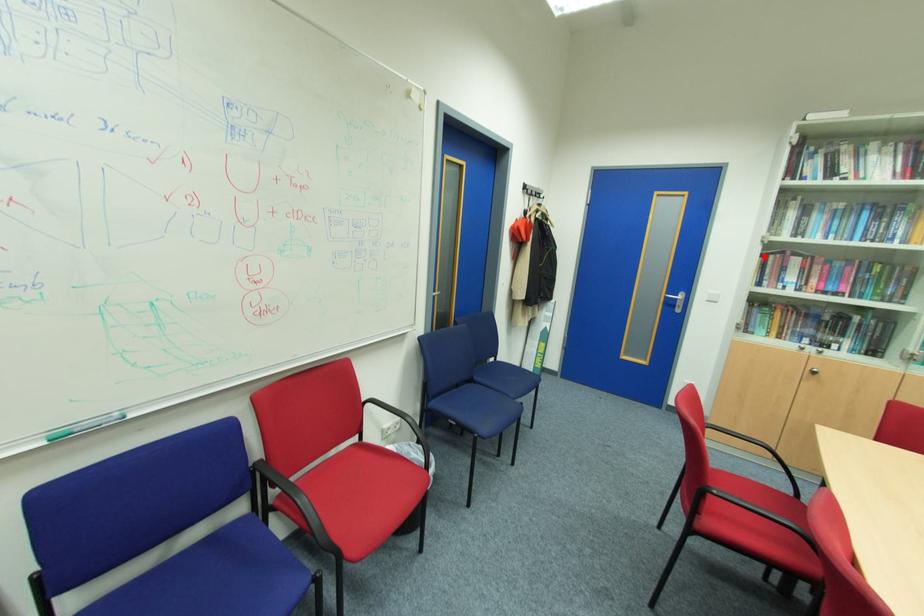
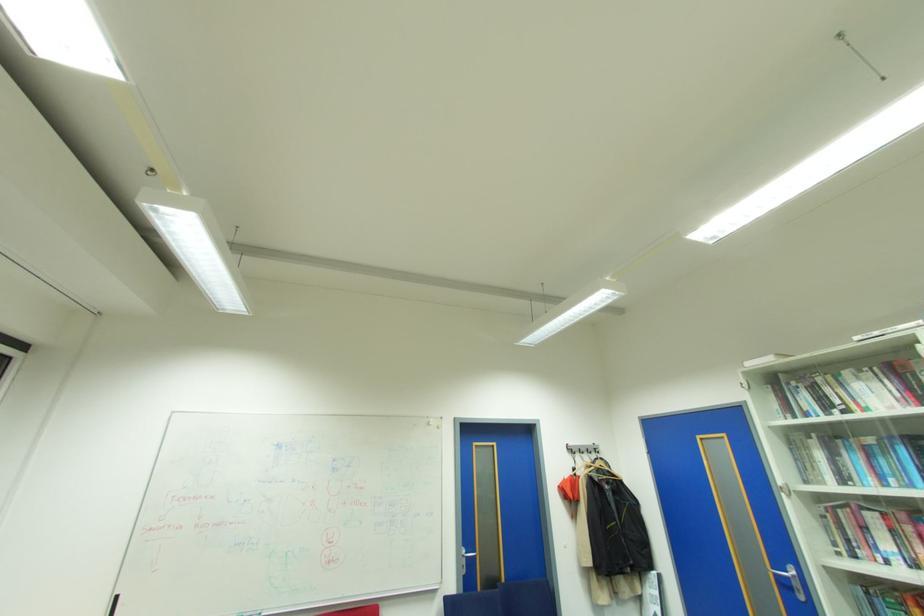
The point at the highlighted location is marked in the first image. Where is the corresponding point in the second image?

(832, 512)